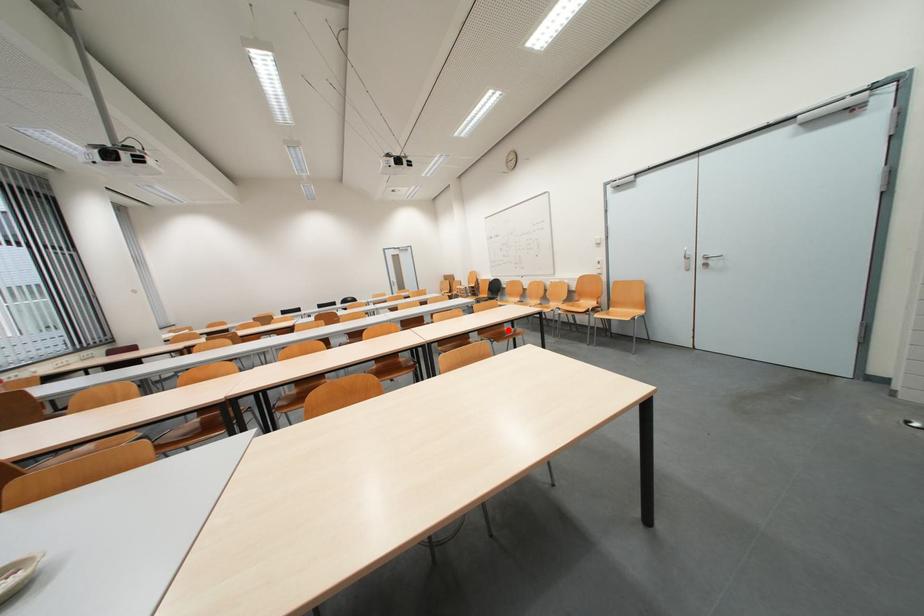
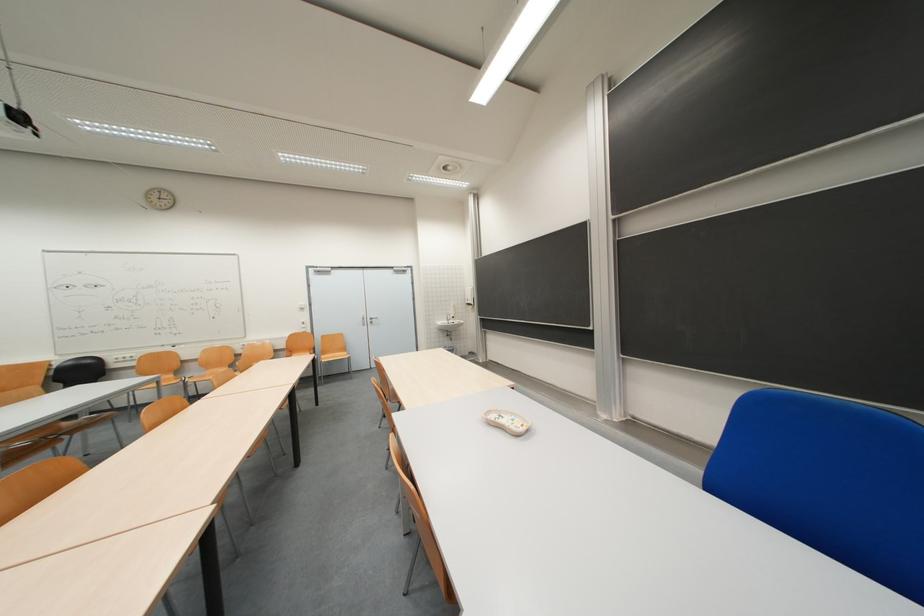
Question: I am providing you with two images of the same scene from different viewpoints. A red point is marked on the first image. At the location where the point appears in image 1, is it still visible in image 2?

Choices:
 (A) Yes
 (B) No

Answer: (B)